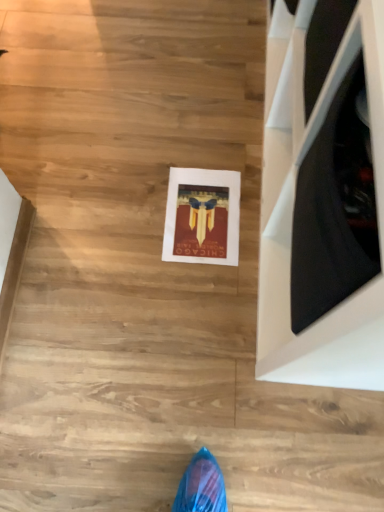
The height and width of the screenshot is (512, 384). Identify the location of vacant space situated on the left part of white glossy shelf at right. (137, 161).